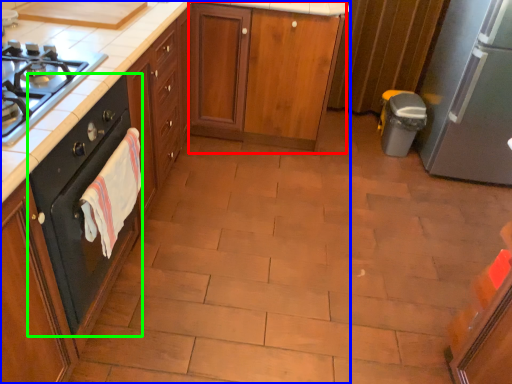
Question: Estimate the real-world distances between objects in this image. Which object is closer to cabinetry (highlighted by a red box), cabinetry (highlighted by a blue box) or home appliance (highlighted by a green box)?

Choices:
 (A) cabinetry
 (B) home appliance

Answer: (A)